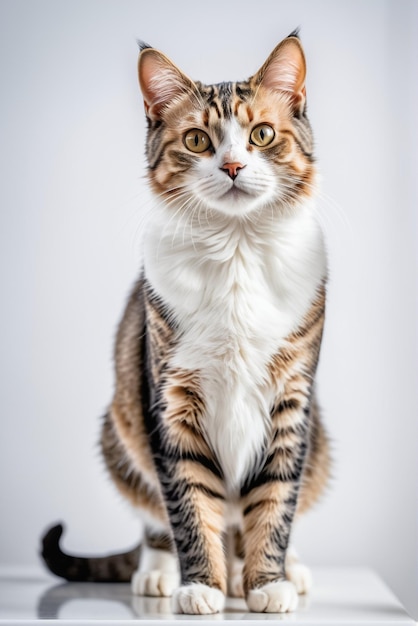
The height and width of the screenshot is (626, 418). I want to click on white fur, so click(225, 441), click(161, 571), click(182, 590), click(268, 593), click(303, 577), click(235, 197).